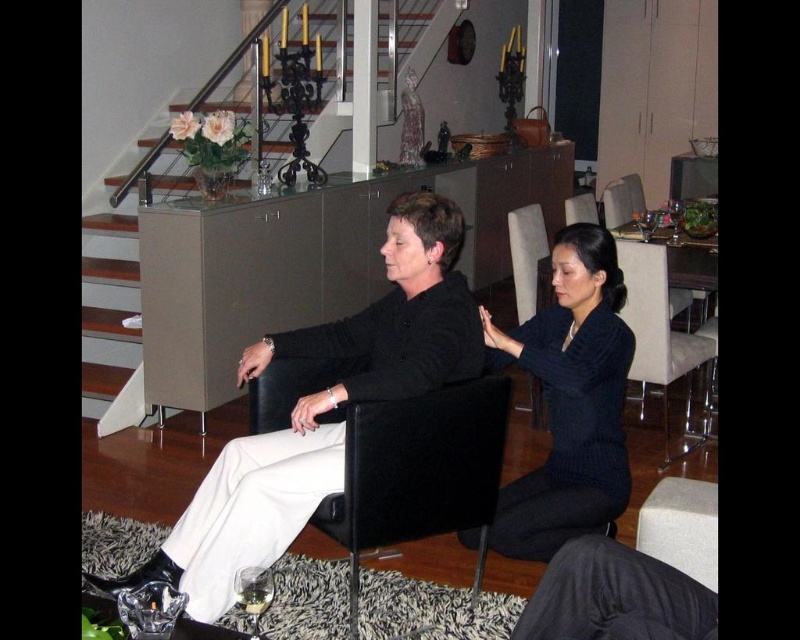
You are a photographer setting up a shoot in this room. You want to place a small prop between the dark blue sweater at center and the dark gray fabric pants at lower center. Based on their positions, where should you position the prop so it is equidistant from both objects?

The dark blue sweater at center is further to the viewer than the dark gray fabric pants at lower center. To place the prop equidistant between them, position it closer to the dark gray fabric pants at lower center since the sweater is nearer to you, balancing the distance between both objects.

In the scene shown: You are a delivery person holding a package that requires a 2.5 meter clearance to maneuver safely. You need to navigate between the dark gray fabric pants at lower center and the dark gray leather armchair at center. Can you safely pass through the space between them without hitting the package?

The distance between the dark gray fabric pants at lower center and the dark gray leather armchair at center is 2.45 meters. Since the required clearance is 2.5 meters, the package cannot safely pass through the space between them without the risk of collision.

You are a fashion designer observing the scene. You notice the dark blue sweater at center and the dark gray fabric pants at lower center. Which clothing item appears to be bigger in size?

The dark blue sweater at center has a larger size compared to the dark gray fabric pants at lower center, so the dark blue sweater at center is bigger in size.